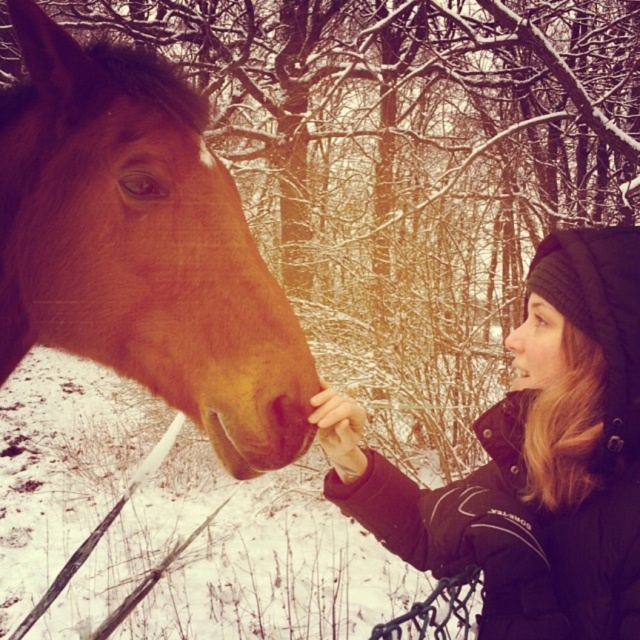
Does brown matte horse at left have a larger size compared to smooth skin nose at center?

No.

From the picture: Is brown matte horse at left wider than smooth skin nose at center?

Incorrect, brown matte horse at left's width does not surpass smooth skin nose at center's.

Does point (124, 291) come farther from viewer compared to point (513, 352)?

No, (124, 291) is closer to viewer.

The width and height of the screenshot is (640, 640). I want to click on brown matte horse at left, so click(141, 246).

Is brown matte horse at left wider than black woolen beanie at upper right?

Indeed, brown matte horse at left has a greater width compared to black woolen beanie at upper right.

Which is in front, point (259, 438) or point (509, 557)?

Positioned in front is point (259, 438).

Who is more forward, (198, 136) or (515, 608)?

Point (515, 608) is in front.

Image resolution: width=640 pixels, height=640 pixels. I want to click on brown matte horse at left, so click(x=141, y=246).

Can you confirm if black woolen beanie at upper right is positioned above smooth skin nose at center?

No.

Find the location of a particular element. The width and height of the screenshot is (640, 640). black woolen beanie at upper right is located at coordinates (532, 460).

Locate an element on the screen. black woolen beanie at upper right is located at coordinates (532, 460).